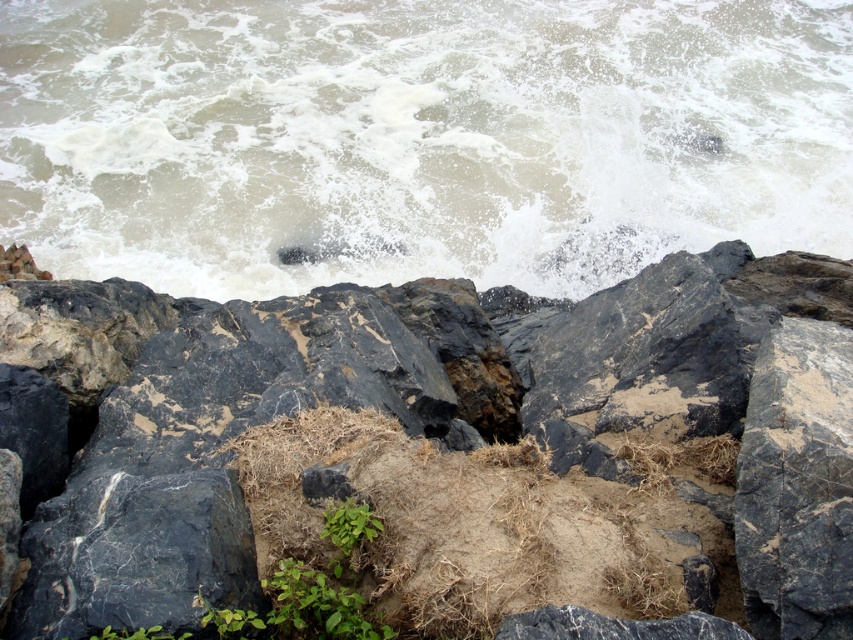
You are a geologist examining the coastal area. You notice the black marble rock at center and the white frothy water at upper center. Which object occupies a larger area in the scene?

The white frothy water at upper center occupies a larger area in the scene because the black marble rock at center has a smaller size compared to it.

You are a hiker trying to navigate the rocky terrain. You see the black marble rock at center and the white frothy water at upper center. Which object is taller?

The white frothy water at upper center is taller than the black marble rock at center.

You are a geologist examining the coastal area shown in the image. You need to locate the black marble rock at center for a sample collection. According to the coordinates provided, where exactly should you look for it?

The black marble rock at center is located at coordinates point (461, 449).